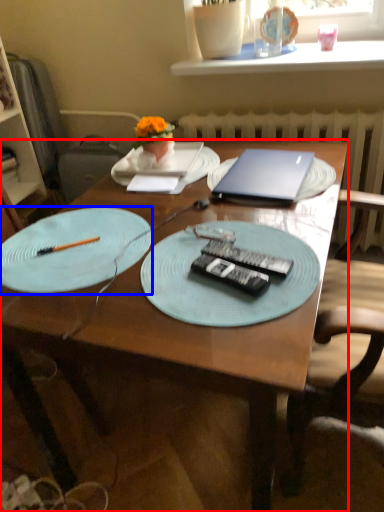
Question: Which point is further to the camera, desk (highlighted by a red box) or plate (highlighted by a blue box)?

Choices:
 (A) desk
 (B) plate

Answer: (B)